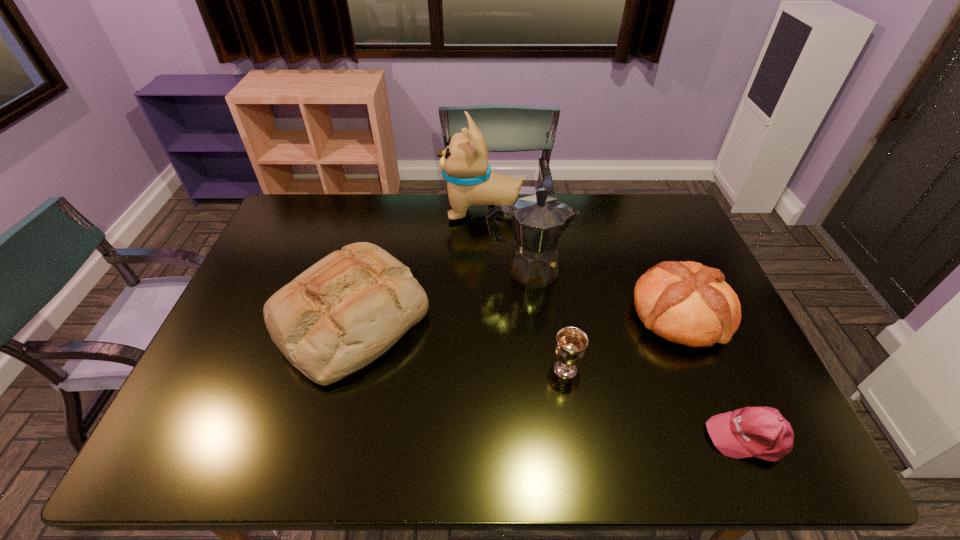
The height and width of the screenshot is (540, 960). I want to click on object situated at the left edge, so click(x=345, y=311).

Locate an element on the screen. bread at the right edge is located at coordinates (687, 303).

Where is `baseball cap present at the right edge`? Image resolution: width=960 pixels, height=540 pixels. baseball cap present at the right edge is located at coordinates (762, 432).

Where is `object that is at the near right corner`? The image size is (960, 540). object that is at the near right corner is located at coordinates (762, 432).

You are a GUI agent. You are given a task and a screenshot of the screen. Output one action in this format:
    pyautogui.click(x=<x>, y=<y>)
    Task: Click on the vacant space at the far edge of the desktop
    This screenshot has height=540, width=960.
    Given the screenshot: What is the action you would take?
    pyautogui.click(x=385, y=227)

Find the location of a particular element. vacant space at the near edge is located at coordinates (339, 466).

Find the location of a particular element. vacant space at the left edge of the desktop is located at coordinates click(257, 277).

The width and height of the screenshot is (960, 540). I want to click on vacant region at the far left corner of the desktop, so click(297, 207).

Locate an element on the screen. The image size is (960, 540). free point between the shorter bread and the left bread is located at coordinates (516, 316).

Image resolution: width=960 pixels, height=540 pixels. What are the coordinates of `free space between the third tallest object and the second tallest object` in the screenshot? It's located at (439, 294).